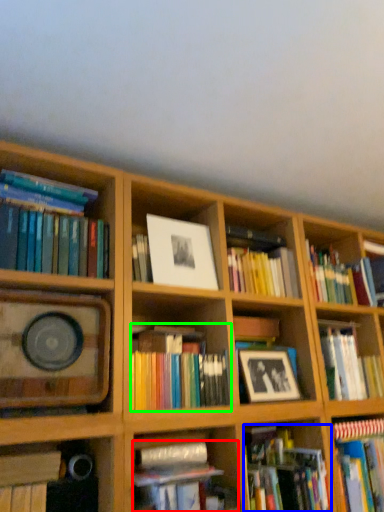
Question: Which is farther away from book (highlighted by a red box)? book (highlighted by a blue box) or book (highlighted by a green box)?

Choices:
 (A) book
 (B) book

Answer: (A)